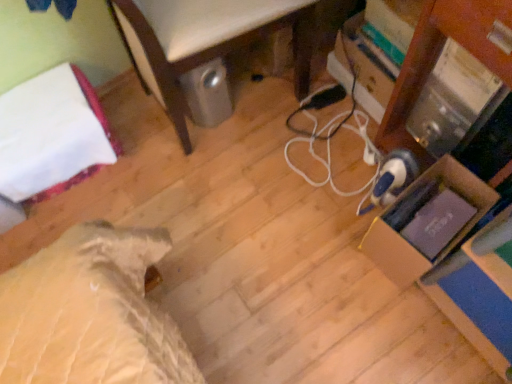
Where is `vacant area on top of white fabric bed at left (from a real-world perspective)`? Image resolution: width=512 pixels, height=384 pixels. vacant area on top of white fabric bed at left (from a real-world perspective) is located at coordinates (42, 115).